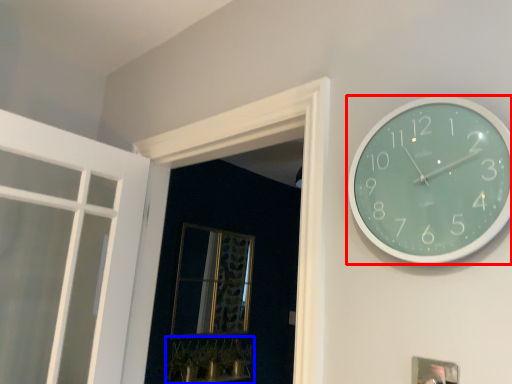
Question: Which of the following is the closest to the observer, wall clock (highlighted by a red box) or plant (highlighted by a blue box)?

Choices:
 (A) wall clock
 (B) plant

Answer: (A)